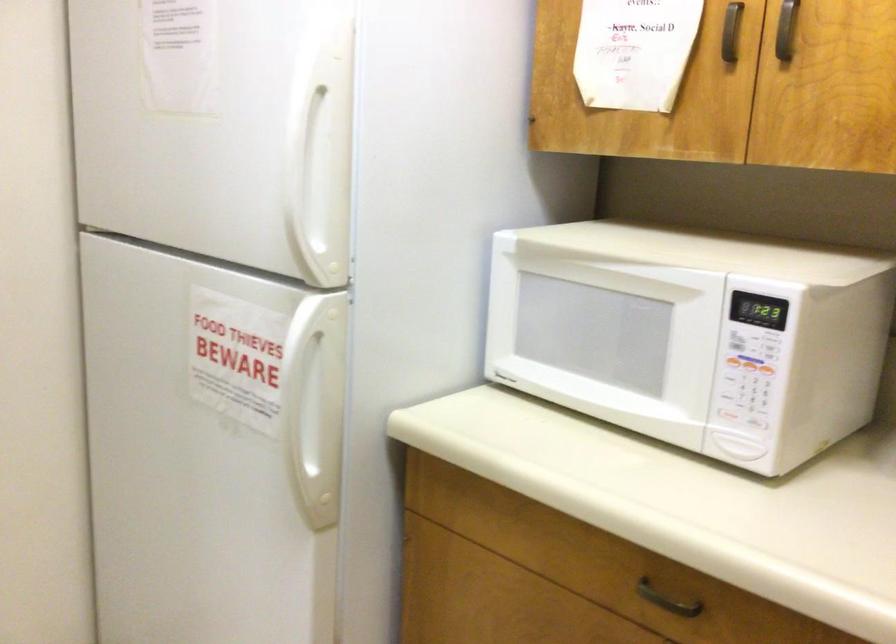
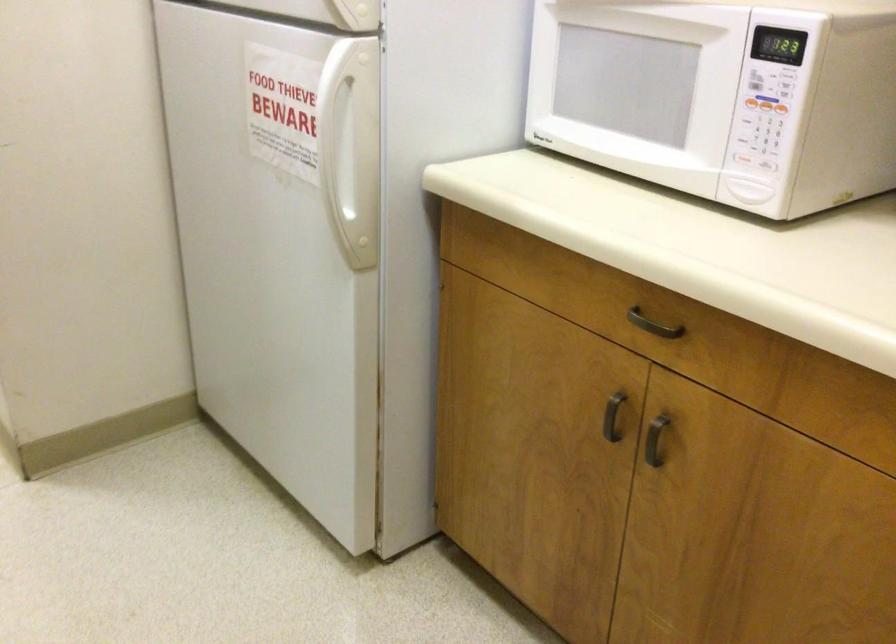
Locate, in the second image, the point that corresponds to point (317, 402) in the first image.

(350, 146)